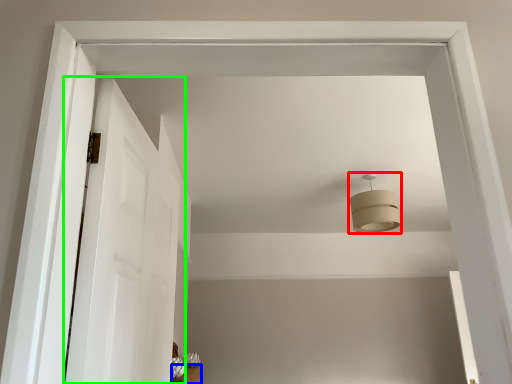
Question: Which object is the farthest from fixture (highlighted by a red box)? Choose among these: furniture (highlighted by a blue box) or door (highlighted by a green box).

Choices:
 (A) furniture
 (B) door

Answer: (A)